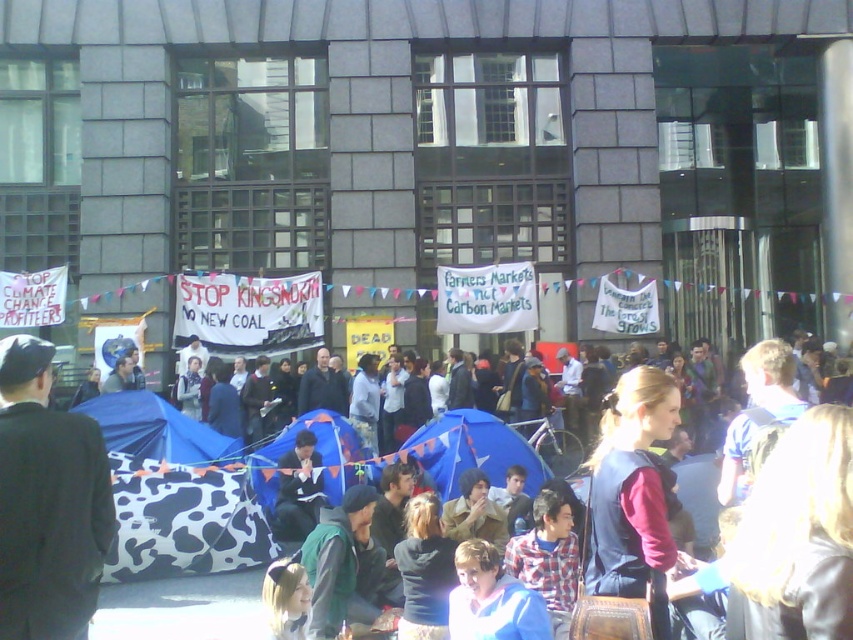
Does dark suit at center appear on the right side of dark blue fabric at center?

Incorrect, dark suit at center is not on the right side of dark blue fabric at center.

Can you confirm if dark suit at center is bigger than dark blue fabric at center?

Indeed, dark suit at center has a larger size compared to dark blue fabric at center.

Describe the element at coordinates (47, 502) in the screenshot. This screenshot has width=853, height=640. I see `dark suit at center` at that location.

Where is `dark suit at center`? dark suit at center is located at coordinates (47, 502).

Between cow print fabric tent at center and dark blue fabric at center, which one appears on the right side from the viewer's perspective?

dark blue fabric at center

Which is more to the left, cow print fabric tent at center or dark blue fabric at center?

cow print fabric tent at center

You are a GUI agent. You are given a task and a screenshot of the screen. Output one action in this format:
    pyautogui.click(x=<x>, y=<y>)
    Task: Click on the cow print fabric tent at center
    
    Given the screenshot: What is the action you would take?
    pyautogui.click(x=312, y=460)

Is blue fabric tent at center to the right of dark blue fabric at center from the viewer's perspective?

Indeed, blue fabric tent at center is positioned on the right side of dark blue fabric at center.

Between point (531, 484) and point (320, 467), which one is positioned behind?

The point (531, 484) is more distant.

Image resolution: width=853 pixels, height=640 pixels. What do you see at coordinates (473, 451) in the screenshot? I see `blue fabric tent at center` at bounding box center [473, 451].

In order to click on blue fabric tent at center in this screenshot , I will do `click(473, 451)`.